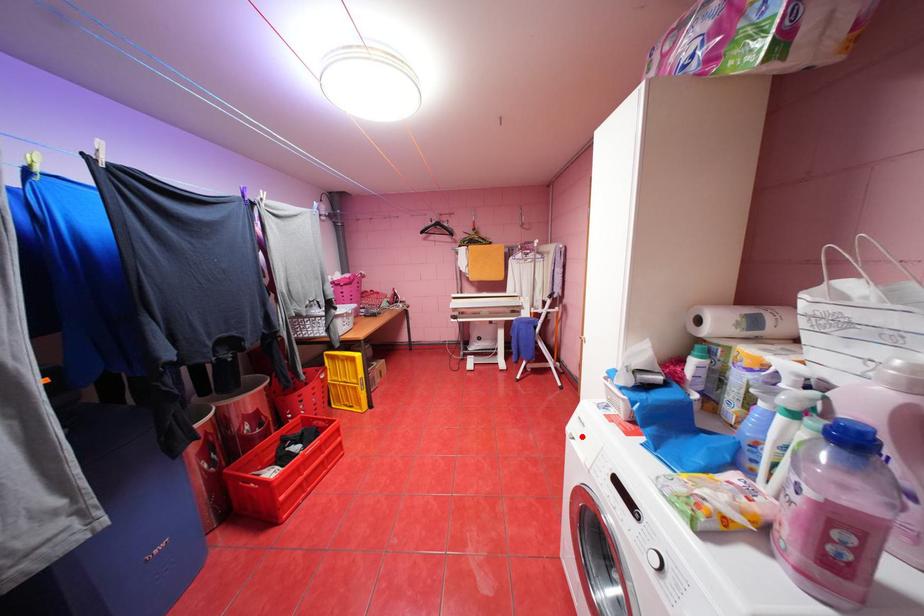
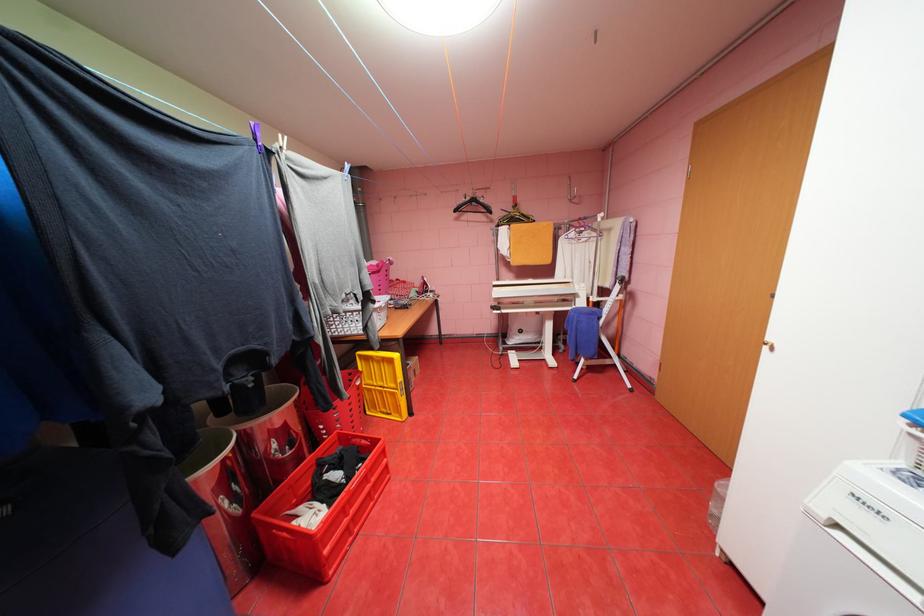
In the second image, find the point that corresponds to the highlighted location in the first image.

(845, 525)